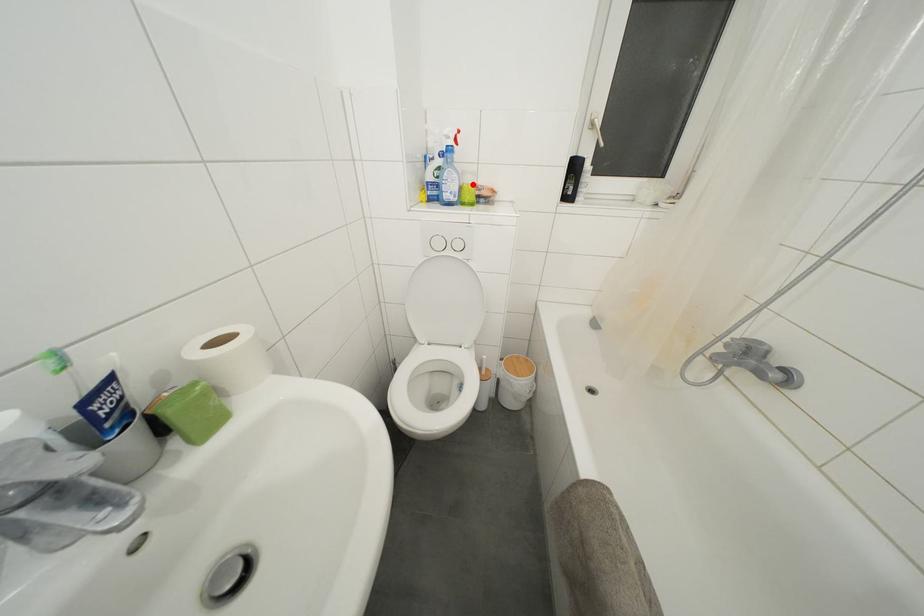
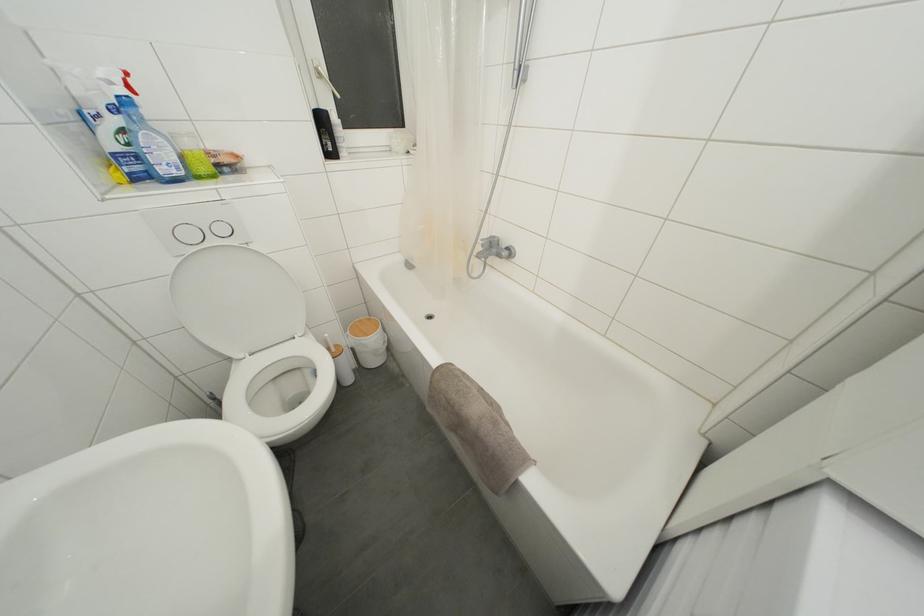
Find the pixel in the second image that matches the highlighted location in the first image.

(193, 148)